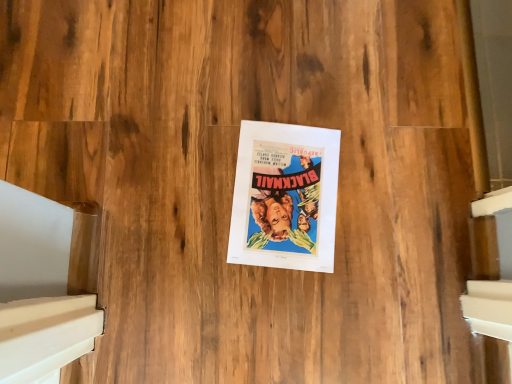
The width and height of the screenshot is (512, 384). I want to click on free space to the left of matte paper poster at center, so click(x=182, y=151).